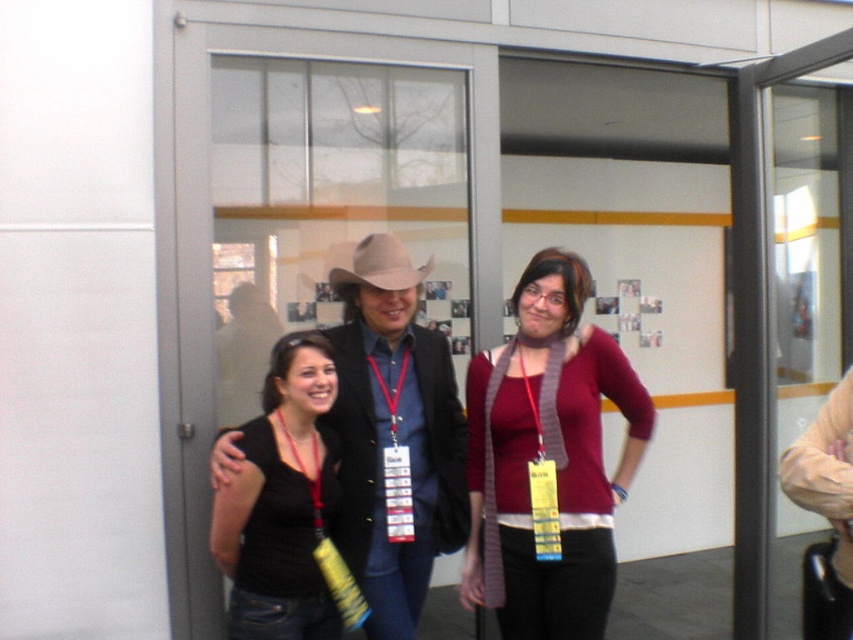
Question: Can you confirm if matte black jacket at center is positioned to the left of black matte shirt at center?

Choices:
 (A) yes
 (B) no

Answer: (B)

Question: Which object is positioned farthest from the black matte shirt at center?

Choices:
 (A) matte red sweater at center
 (B) matte black jacket at center

Answer: (A)

Question: Which point is closer to the camera taking this photo?

Choices:
 (A) (376, 602)
 (B) (566, 513)

Answer: (B)

Question: Is matte black jacket at center thinner than black matte shirt at center?

Choices:
 (A) yes
 (B) no

Answer: (A)

Question: Which point is farther from the camera taking this photo?

Choices:
 (A) (337, 557)
 (B) (386, 534)
 (C) (467, 401)
 (D) (399, 289)

Answer: (C)

Question: Is matte black jacket at center wider than black matte shirt at center?

Choices:
 (A) no
 (B) yes

Answer: (A)